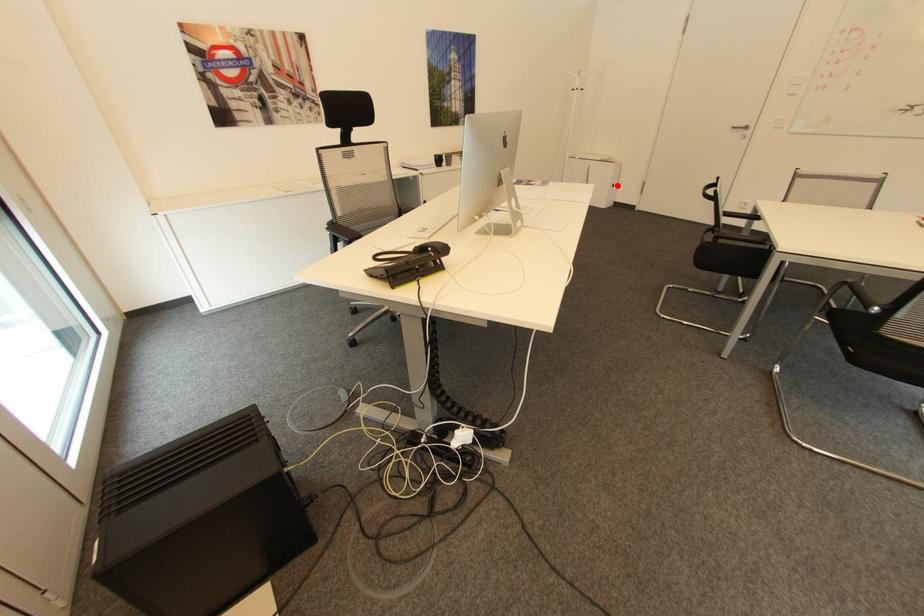
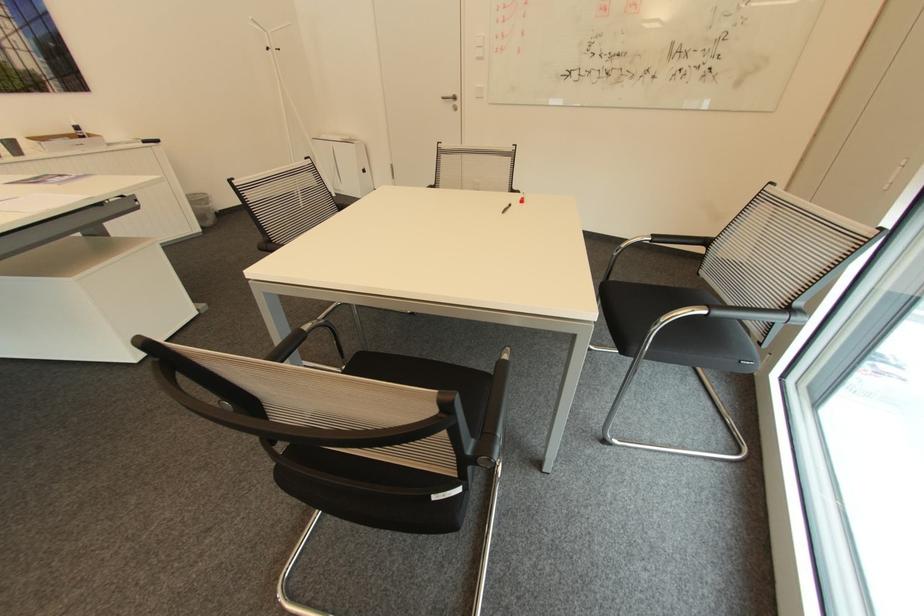
Locate, in the second image, the point that corresponds to the highlighted location in the first image.

(369, 171)